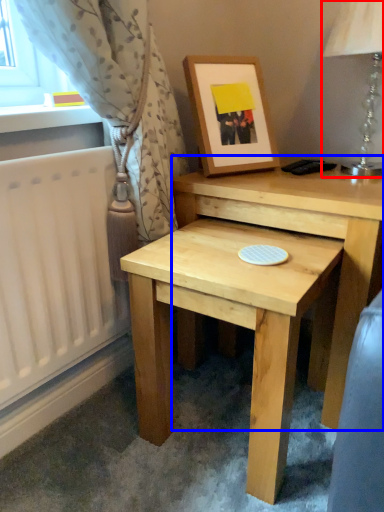
Question: Which of the following is the closest to the observer, table lamp (highlighted by a red box) or table (highlighted by a blue box)?

Choices:
 (A) table lamp
 (B) table

Answer: (B)